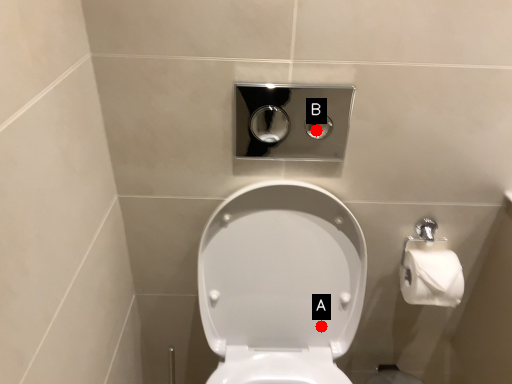
Question: Two points are circled on the image, labeled by A and B beside each circle. Which point is closer to the camera?

Choices:
 (A) A is closer
 (B) B is closer

Answer: (A)